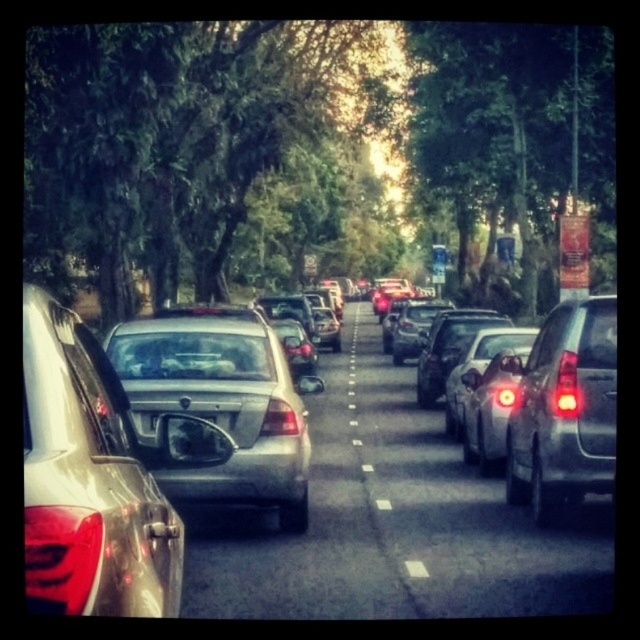
You are a traffic officer trying to identify vehicles in a congested street. You notice a matte black suv at right and a black matte license plate at center. Which object is bigger in size?

The matte black suv at right is larger in size than the black matte license plate at center.

You are driving a car that is 4 meters long and need to merge into the lane with the matte black suv at right and matte black car at right. Can your car fit between them without touching either vehicle?

The distance between the matte black suv at right and matte black car at right is 3.69 meters. Since your car is 4 meters long, it cannot fit between them without touching either vehicle.

You are a pedestrian standing on the sidewalk observing the traffic. You notice the matte black suv at right and the black matte license plate at center. Which object is closer to you?

The matte black suv at right is closer to you because it is further to the viewer than the black matte license plate at center, meaning it appears nearer in the scene.